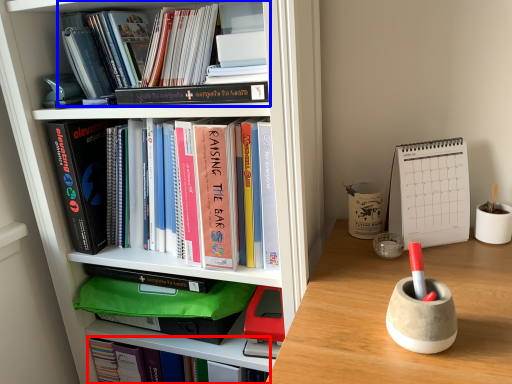
Question: Which point is further to the camera, book (highlighted by a red box) or book (highlighted by a blue box)?

Choices:
 (A) book
 (B) book

Answer: (A)